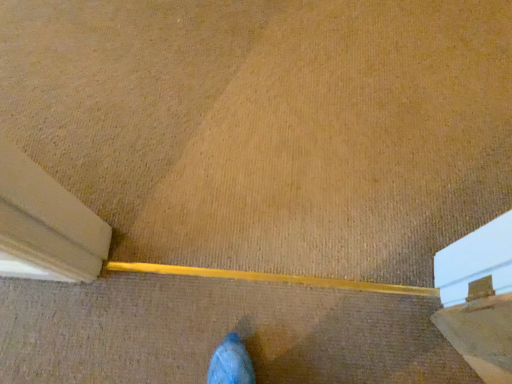
What do you see at coordinates (93, 236) in the screenshot? Image resolution: width=512 pixels, height=384 pixels. I see `brown textured brush at center` at bounding box center [93, 236].

Find the location of `brown textured brush at center`. brown textured brush at center is located at coordinates (93, 236).

I want to click on brown textured brush at center, so click(x=93, y=236).